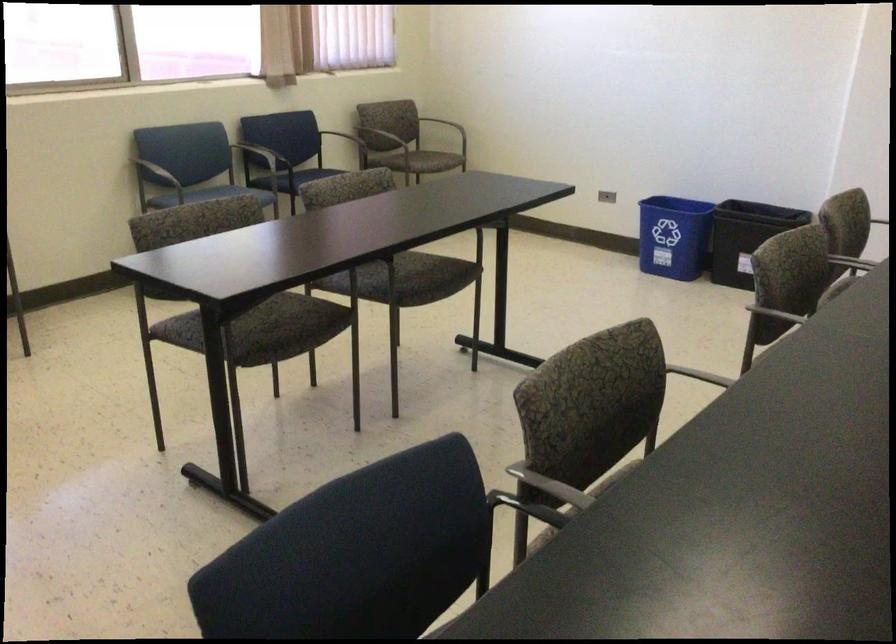
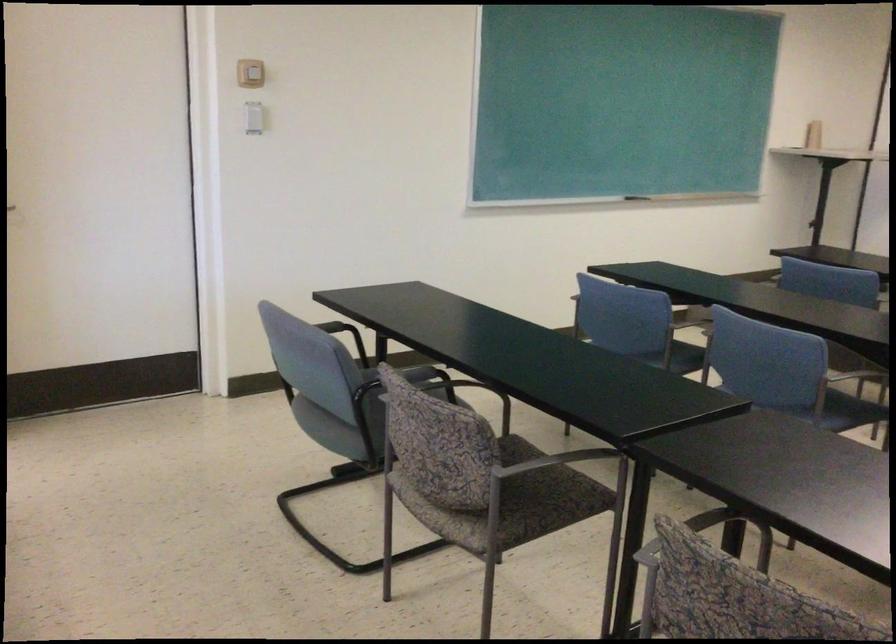
Question: The images are taken continuously from a first-person perspective. In which direction are you moving?

Choices:
 (A) Left
 (B) Right
 (C) Forward
 (D) Backward

Answer: (D)